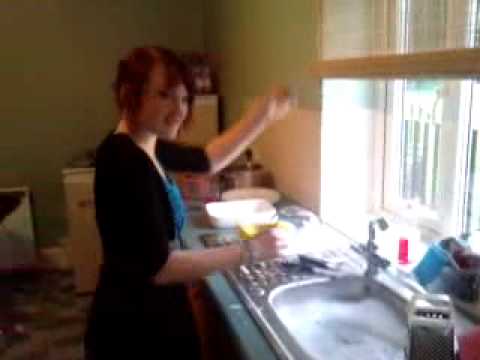
The width and height of the screenshot is (480, 360). In order to click on window blinds in this screenshot , I will do `click(441, 59)`.